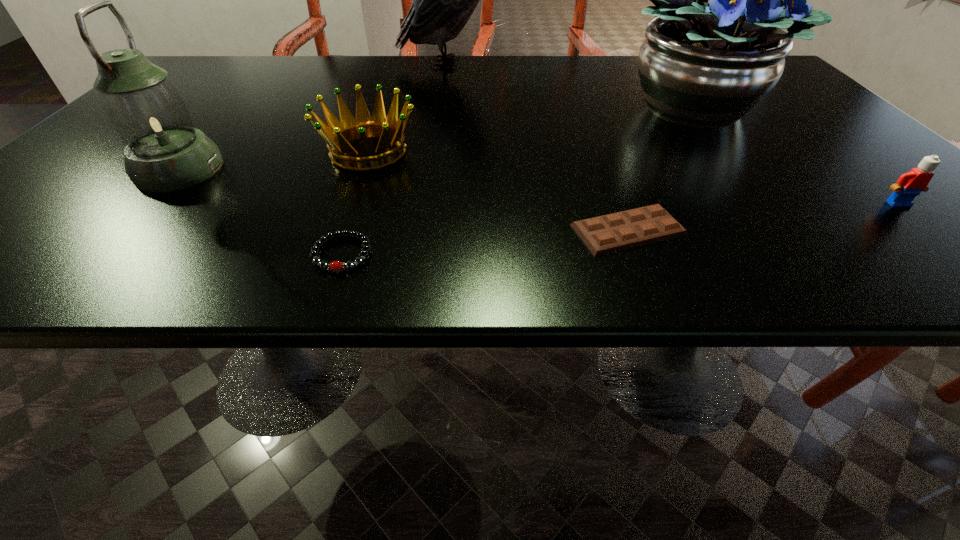
Identify the location of the farthest object. (443, 0).

Locate an element on the screen. parrot is located at coordinates (443, 0).

Locate an element on the screen. The image size is (960, 540). bouquet is located at coordinates (716, 49).

Find the location of a particular element. The image size is (960, 540). the leftmost object is located at coordinates (164, 152).

This screenshot has height=540, width=960. I want to click on crown, so click(x=338, y=135).

Find the location of a particular element. Image resolution: width=960 pixels, height=540 pixels. the rightmost object is located at coordinates (909, 185).

In order to click on chocolate bar in this screenshot , I will do `click(615, 232)`.

Locate an element on the screen. The height and width of the screenshot is (540, 960). bracelet is located at coordinates (334, 266).

The image size is (960, 540). Find the location of `vacant space located 0.380m on the front-facing side of the farthest object`. vacant space located 0.380m on the front-facing side of the farthest object is located at coordinates pos(653,63).

Find the location of a particular element. Image resolution: width=960 pixels, height=540 pixels. vacant space located on the left of the bouquet is located at coordinates (446, 106).